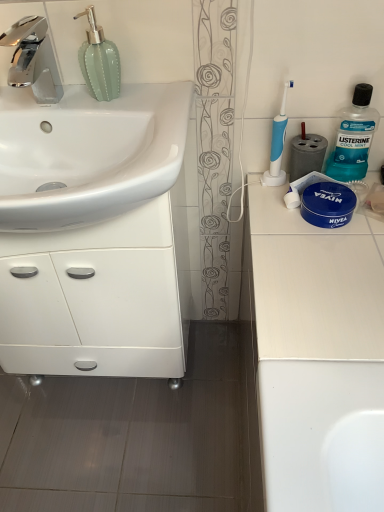
Question: Visually, is white glossy sink at left positioned to the left or to the right of teal plastic mouthwash at upper right?

Choices:
 (A) left
 (B) right

Answer: (A)

Question: From a real-world perspective, is white glossy sink at left above or below teal plastic mouthwash at upper right?

Choices:
 (A) below
 (B) above

Answer: (B)

Question: Which of these objects is positioned closest to the white glossy cabinet at left?

Choices:
 (A) chrome metallic faucet at upper left
 (B) teal plastic mouthwash at upper right
 (C) blue plastic toothbrush at upper right
 (D) green glass soap dispenser at upper left
 (E) white glossy sink at left

Answer: (E)

Question: Estimate the real-world distances between objects in this image. Which object is closer to the chrome metallic faucet at upper left?

Choices:
 (A) teal plastic mouthwash at upper right
 (B) white glossy cabinet at left
 (C) white matte countertop at right
 (D) green glass soap dispenser at upper left
 (E) blue plastic toothbrush at upper right

Answer: (D)